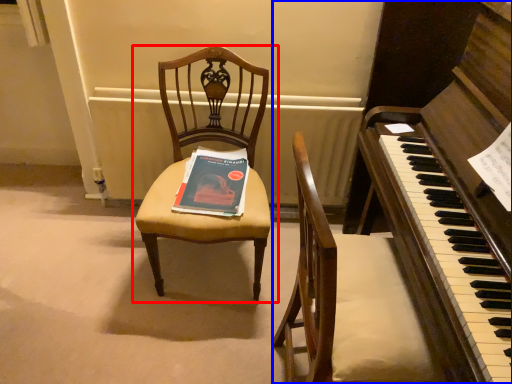
Question: Which object is further to the camera taking this photo, chair (highlighted by a red box) or harpsichord (highlighted by a blue box)?

Choices:
 (A) chair
 (B) harpsichord

Answer: (A)